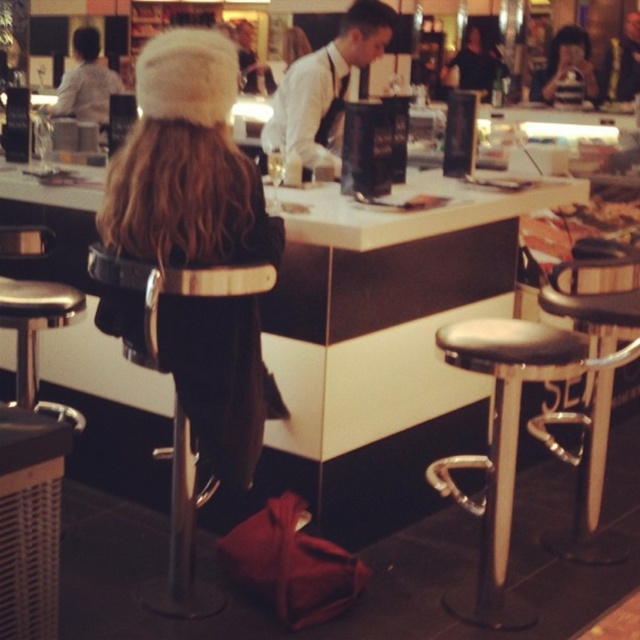
You are standing in the modern cafe and want to place a small plant between the two points, point (x=474, y=609) and point (x=310, y=120). Which point should the plant be closer to so that it appears closer to you?

The plant should be placed closer to point (x=474, y=609) because it is closer to the viewer than point (x=310, y=120).

You are a customer in the cafe and want to sit down. You see the black leather stool at right and the white shirt at center. Which object is closer to the floor?

The black leather stool at right is closer to the floor because it is below the white shirt at center.